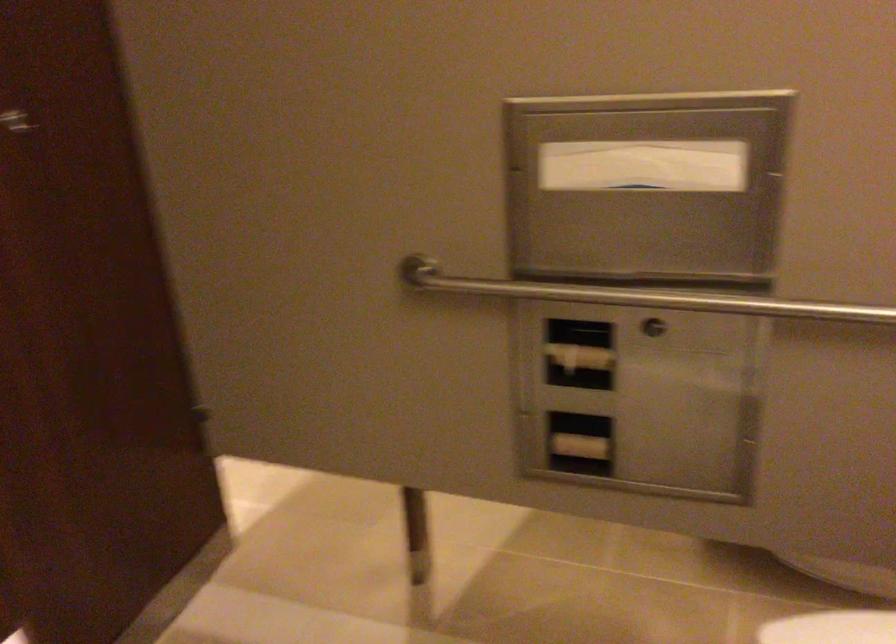
In order to click on metal grab bar in this screenshot , I will do `click(639, 296)`.